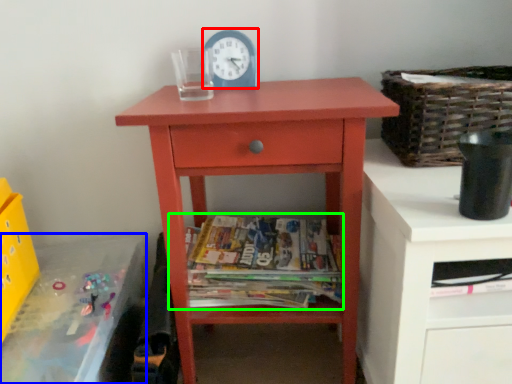
Question: Which object is positioned farthest from clock (highlighted by a red box)? Select from changing table (highlighted by a blue box) and magazine (highlighted by a green box).

Choices:
 (A) changing table
 (B) magazine

Answer: (A)